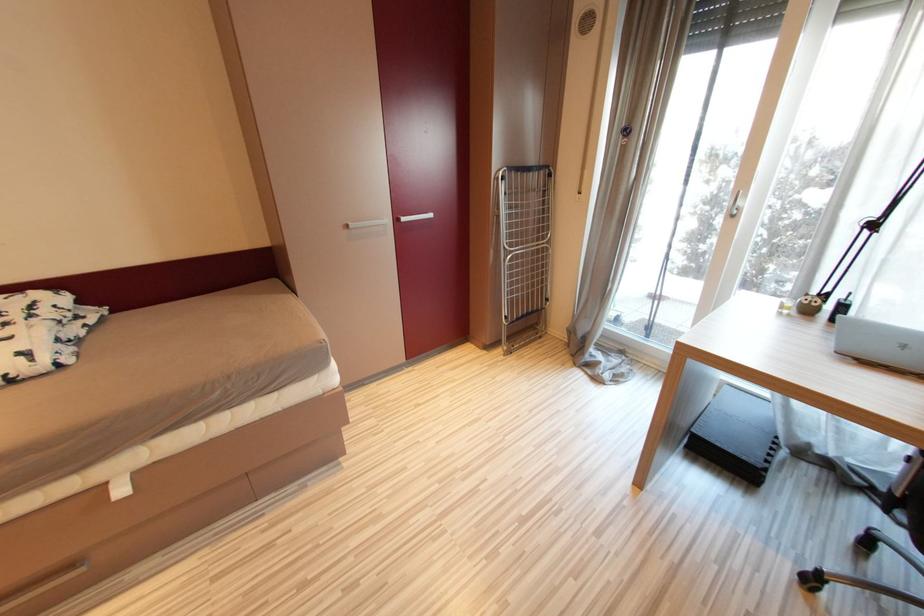
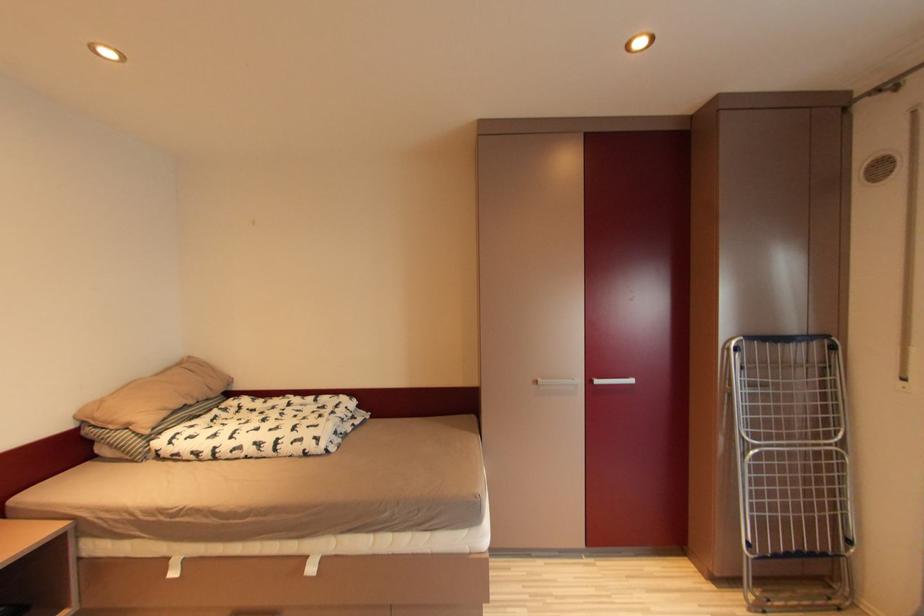
The images are taken continuously from a first-person perspective. In which direction is your viewpoint rotating?

The camera's rotation is toward left-up.